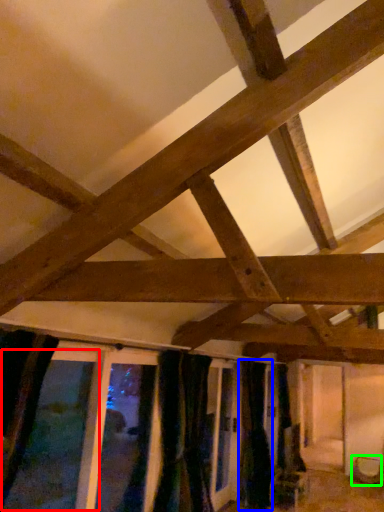
Question: Which object is the closest to the window (highlighted by a red box)? Choose among these: curtain (highlighted by a blue box) or furniture (highlighted by a green box).

Choices:
 (A) curtain
 (B) furniture

Answer: (A)